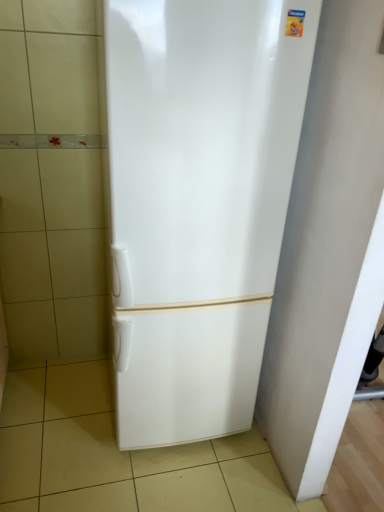
The height and width of the screenshot is (512, 384). In order to click on white glossy refrigerator at center in this screenshot , I will do point(198,203).

Describe the element at coordinates (198, 203) in the screenshot. I see `white glossy refrigerator at center` at that location.

Where is `white glossy refrigerator at center`? The width and height of the screenshot is (384, 512). white glossy refrigerator at center is located at coordinates (198, 203).